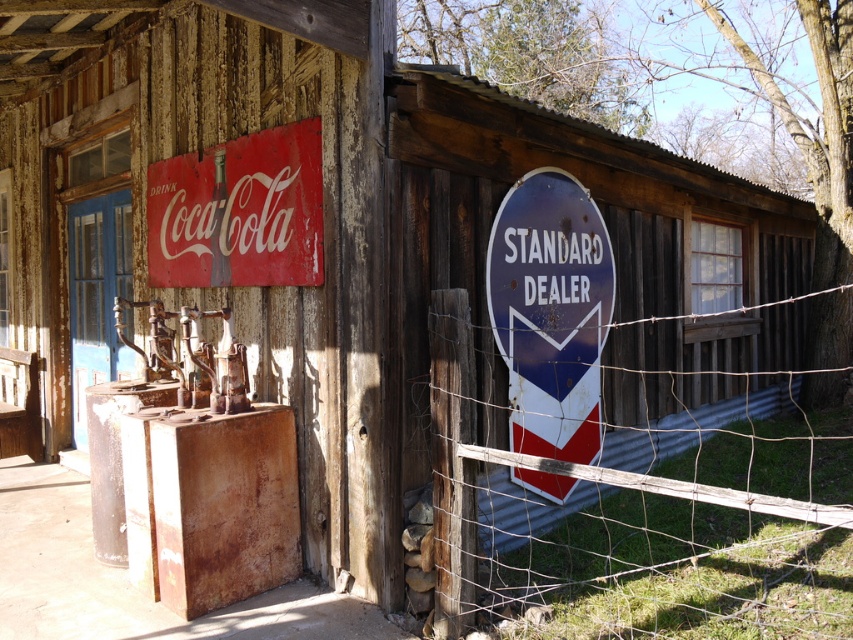
You are standing in front of the rustic wooden building and notice two items on the right side. Which one takes up more space visually between the wire mesh at right and the metallic blue sign at right?

The wire mesh at right is bigger than the metallic blue sign at right, so it takes up more visual space.

Based on the scene description, where is the wire mesh at right located in terms of coordinates?

The wire mesh at right is located at coordinates point [660,548].